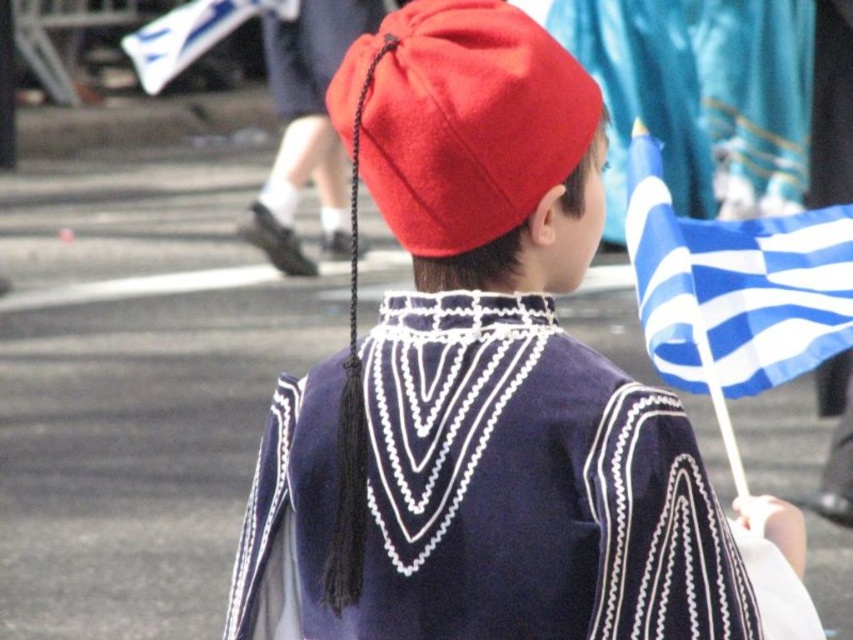
Looking at this image, between matte red beret at center and blue fabric flag at right, which one is positioned higher?

blue fabric flag at right is higher up.

Can you confirm if matte red beret at center is positioned below blue fabric flag at right?

Yes.

What do you see at coordinates (488, 378) in the screenshot?
I see `matte red beret at center` at bounding box center [488, 378].

I want to click on matte red beret at center, so coord(488,378).

In the scene shown: Measure the distance from matte red beret at center to matte red cap at center.

matte red beret at center is 4.79 inches from matte red cap at center.

Is matte red beret at center behind matte red cap at center?

No, matte red beret at center is closer to the viewer.

Locate an element on the screen. This screenshot has width=853, height=640. matte red beret at center is located at coordinates (488, 378).

This screenshot has height=640, width=853. I want to click on matte red beret at center, so click(488, 378).

Is matte red cap at center bigger than blue fabric flag at right?

Incorrect, matte red cap at center is not larger than blue fabric flag at right.

What are the coordinates of `matte red cap at center` in the screenshot? It's located at (462, 120).